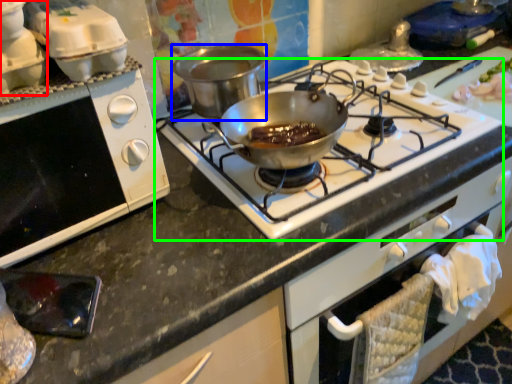
Question: Considering the real-world distances, which object is closest to kitchen appliance (highlighted by a red box)? pot/pan (highlighted by a blue box) or gas stove (highlighted by a green box).

Choices:
 (A) pot/pan
 (B) gas stove

Answer: (A)